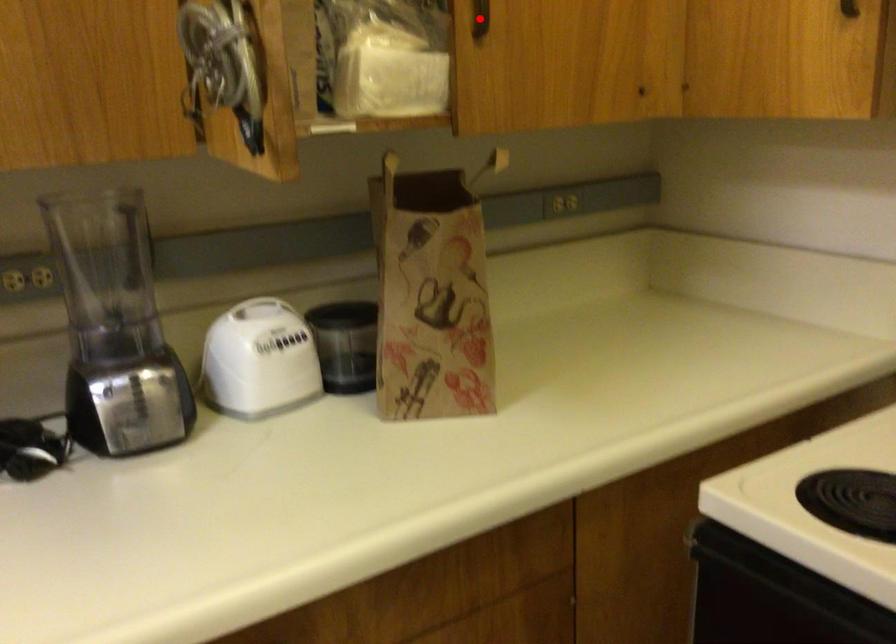
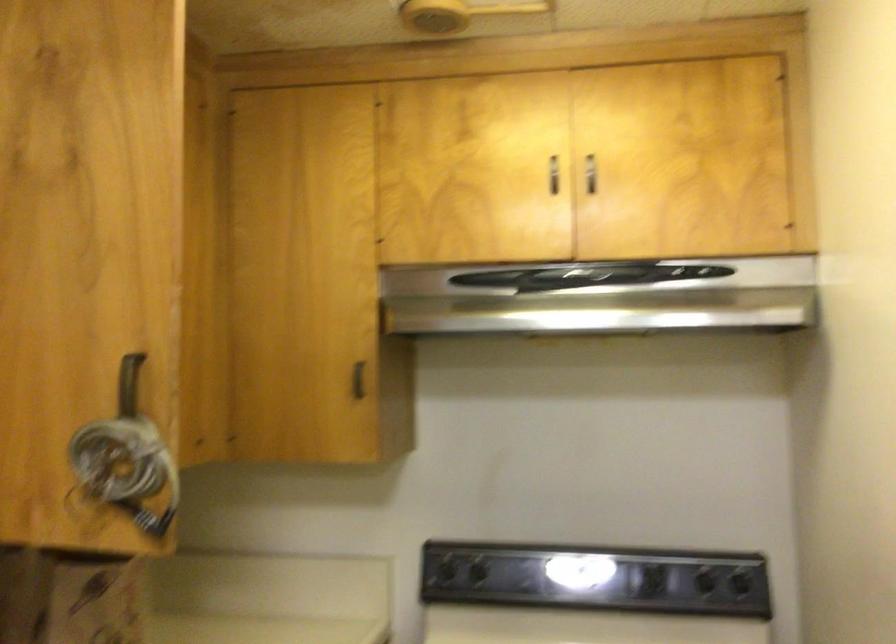
In the second image, find the point that corresponds to the highlighted location in the first image.

(116, 406)